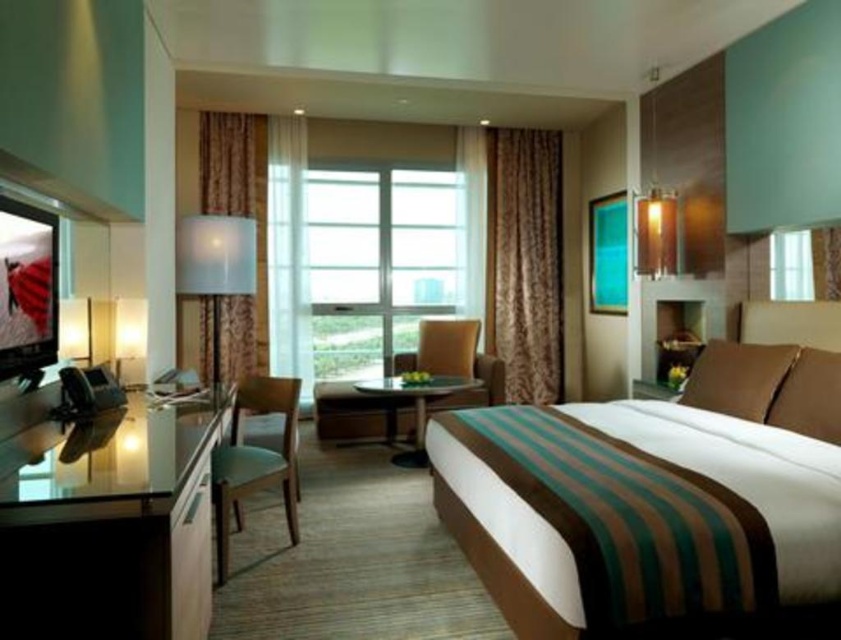
Can you confirm if clear glass table at left is positioned to the right of clear glass window at center?

Incorrect, clear glass table at left is not on the right side of clear glass window at center.

I want to click on clear glass table at left, so click(109, 528).

Find the location of a particular element. clear glass table at left is located at coordinates (109, 528).

Measure the distance from clear glass window at center to glass top table at center.

They are 5.14 feet apart.

Does clear glass window at center have a greater height compared to glass top table at center?

Yes, clear glass window at center is taller than glass top table at center.

Is point (408, 291) positioned after point (431, 378)?

That is True.

Identify the location of clear glass window at center. (358, 264).

Is teal fabric chair at left wider than matte gold lampshade at upper right?

Yes.

Consider the image. Can you confirm if teal fabric chair at left is thinner than matte gold lampshade at upper right?

In fact, teal fabric chair at left might be wider than matte gold lampshade at upper right.

Image resolution: width=841 pixels, height=640 pixels. Identify the location of teal fabric chair at left. [255, 460].

Where is `teal fabric chair at left`? This screenshot has width=841, height=640. teal fabric chair at left is located at coordinates (255, 460).